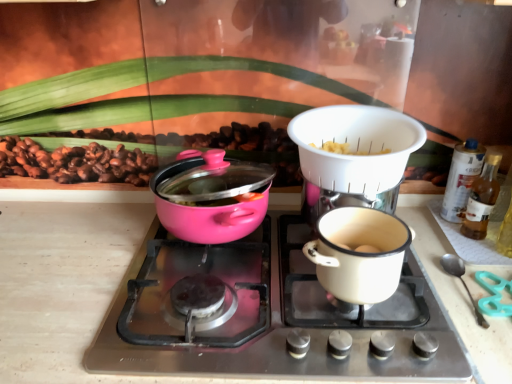
Question: Is white plastic colander at upper center looking in the opposite direction of translucent glass bottle at right, which ranks as the 1th bottle in front-to-back order?

Choices:
 (A) no
 (B) yes

Answer: (A)

Question: Is white plastic colander at upper center outside translucent glass bottle at right, which ranks as the 1th bottle in front-to-back order?

Choices:
 (A) no
 (B) yes

Answer: (B)

Question: Can you confirm if white plastic colander at upper center is bigger than translucent glass bottle at right, which ranks as the 1th bottle in front-to-back order?

Choices:
 (A) no
 (B) yes

Answer: (B)

Question: Does white plastic colander at upper center contain translucent glass bottle at right, which appears as the second bottle when viewed from the back?

Choices:
 (A) yes
 (B) no

Answer: (B)

Question: Can you confirm if white plastic colander at upper center is wider than translucent glass bottle at right, which appears as the second bottle when viewed from the back?

Choices:
 (A) no
 (B) yes

Answer: (B)

Question: Is pink glossy pot at left in front of or behind pink glossy pot at center left in the image?

Choices:
 (A) front
 (B) behind

Answer: (B)

Question: From a real-world perspective, is pink glossy pot at left positioned above or below pink glossy pot at center left?

Choices:
 (A) below
 (B) above

Answer: (B)

Question: Is point (185, 238) closer or farther from the camera than point (289, 210)?

Choices:
 (A) closer
 (B) farther

Answer: (A)

Question: Which is correct: pink glossy pot at left is inside pink glossy pot at center left, or outside of it?

Choices:
 (A) inside
 (B) outside

Answer: (B)

Question: Considering the positions of point (160, 210) and point (463, 157), is point (160, 210) closer or farther from the camera than point (463, 157)?

Choices:
 (A) farther
 (B) closer

Answer: (B)

Question: Considering their positions, is pink glossy pot at left located in front of or behind translucent plastic spray can at right, the 2th bottle when ordered from front to back?

Choices:
 (A) behind
 (B) front

Answer: (B)

Question: From the image's perspective, relative to translucent plastic spray can at right, the 2th bottle when ordered from front to back, is pink glossy pot at left above or below?

Choices:
 (A) above
 (B) below

Answer: (B)

Question: From a real-world perspective, is pink glossy pot at left above or below translucent plastic spray can at right, placed as the first bottle when sorted from back to front?

Choices:
 (A) below
 (B) above

Answer: (B)

Question: Is pink glossy pot at center left situated inside translucent plastic spray can at right, the 2th bottle when ordered from front to back, or outside?

Choices:
 (A) outside
 (B) inside

Answer: (A)

Question: In terms of size, does pink glossy pot at center left appear bigger or smaller than translucent plastic spray can at right, placed as the first bottle when sorted from back to front?

Choices:
 (A) small
 (B) big

Answer: (B)